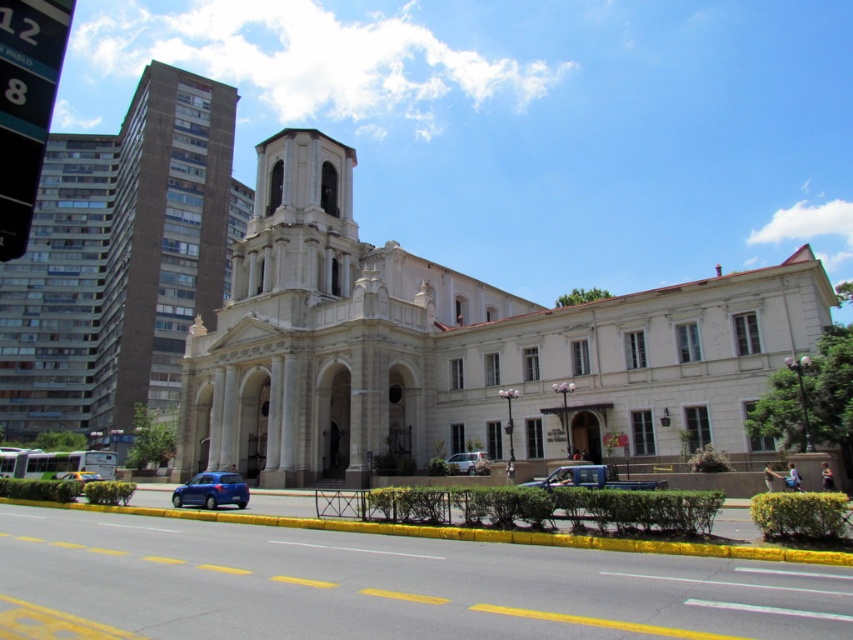
In the scene shown: Is blue matte car at lower left further to camera compared to metallic blue car at center?

No, blue matte car at lower left is in front of metallic blue car at center.

Is blue matte car at lower left wider than metallic blue car at center?

Correct, the width of blue matte car at lower left exceeds that of metallic blue car at center.

I want to click on blue matte car at lower left, so click(x=212, y=490).

Where is `blue matte car at lower left`? blue matte car at lower left is located at coordinates [212, 490].

Is point (172, 280) closer to camera compared to point (450, 460)?

That is False.

Between point (175, 289) and point (468, 465), which one is positioned in front?

Point (468, 465) is more forward.

Identify the location of brown concrete building at left. The image size is (853, 640). (163, 240).

Which is behind, point (177, 92) or point (525, 484)?

The point (177, 92) is behind.

Which is below, brown concrete building at left or blue metallic truck at center?

Positioned lower is blue metallic truck at center.

What do you see at coordinates (163, 240) in the screenshot? I see `brown concrete building at left` at bounding box center [163, 240].

Locate an element on the screen. This screenshot has width=853, height=640. brown concrete building at left is located at coordinates (163, 240).